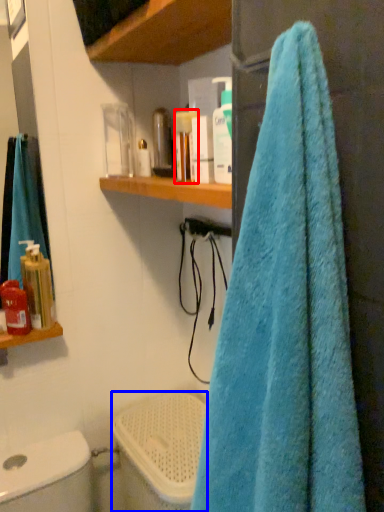
Question: Which object is further to the camera taking this photo, toiletry (highlighted by a red box) or toilet bowl (highlighted by a blue box)?

Choices:
 (A) toiletry
 (B) toilet bowl

Answer: (B)